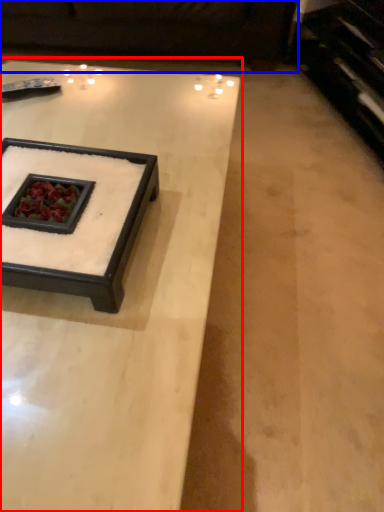
Question: Which object appears closest to the camera in this image, coffee table (highlighted by a red box) or couch (highlighted by a blue box)?

Choices:
 (A) coffee table
 (B) couch

Answer: (A)